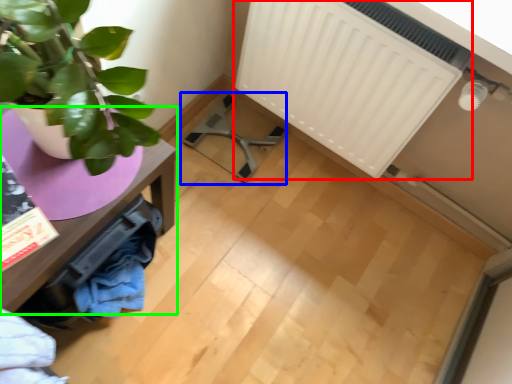
Question: Based on their relative distances, which object is farther from radiator (highlighted by a red box)? Choose from swivel chair (highlighted by a blue box) and table (highlighted by a green box).

Choices:
 (A) swivel chair
 (B) table

Answer: (B)